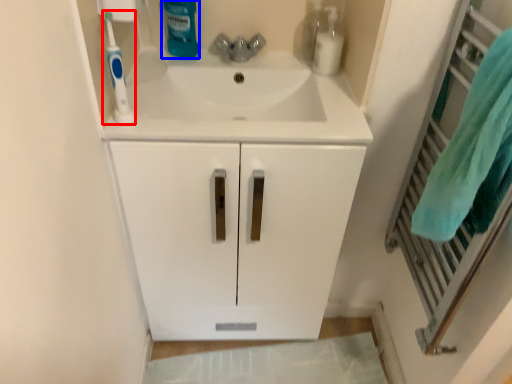
Question: Which point is closer to the camera, toothbrush (highlighted by a red box) or cleaning product (highlighted by a blue box)?

Choices:
 (A) toothbrush
 (B) cleaning product

Answer: (A)